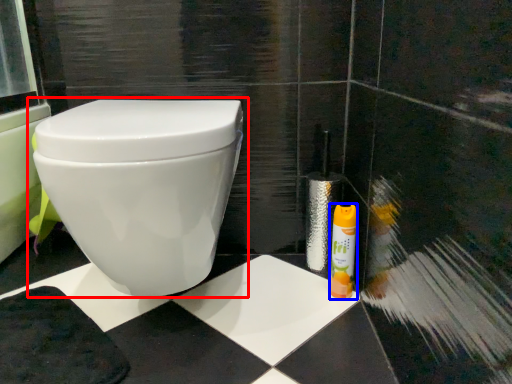
Question: Which point is closer to the camera, toilet (highlighted by a red box) or cleaning product (highlighted by a blue box)?

Choices:
 (A) toilet
 (B) cleaning product

Answer: (A)